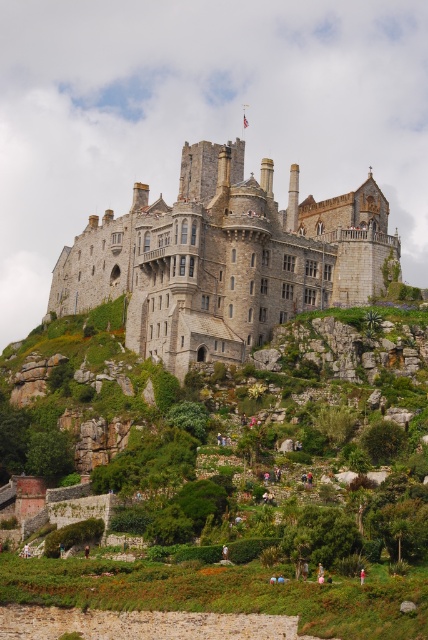
Question: Can you confirm if stone castle at center is positioned below green fabric person at lower center?

Choices:
 (A) yes
 (B) no

Answer: (B)

Question: Which of the following is the closest to the observer?

Choices:
 (A) (222, 554)
 (B) (360, 576)
 (C) (62, 552)
 (D) (240, 157)

Answer: (B)

Question: Is stone castle at center to the right of brown leather jacket at lower center from the viewer's perspective?

Choices:
 (A) yes
 (B) no

Answer: (A)

Question: Which of the following is the farthest from the observer?

Choices:
 (A) red fabric person at center
 (B) stone castle at center

Answer: (B)

Question: Which object is farther from the camera taking this photo?

Choices:
 (A) stone castle at center
 (B) brown leather jacket at lower center
 (C) red fabric person at center
 (D) green fabric person at lower center

Answer: (A)

Question: Is the position of stone castle at center less distant than that of brown leather jacket at lower center?

Choices:
 (A) no
 (B) yes

Answer: (A)